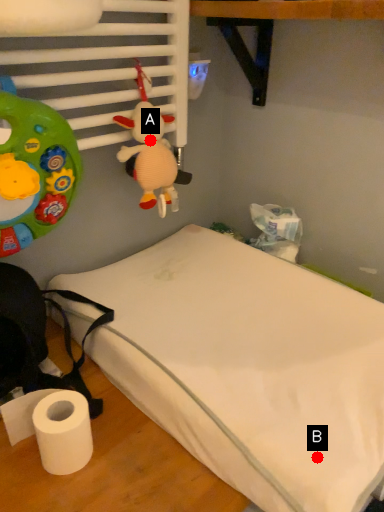
Question: Two points are circled on the image, labeled by A and B beside each circle. Among these points, which one is nearest to the camera?

Choices:
 (A) A is closer
 (B) B is closer

Answer: (B)